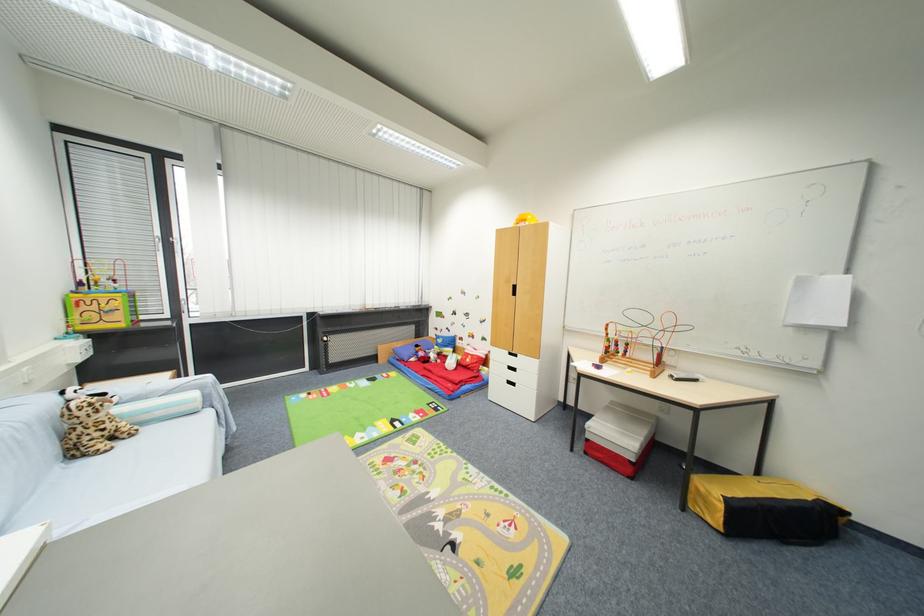
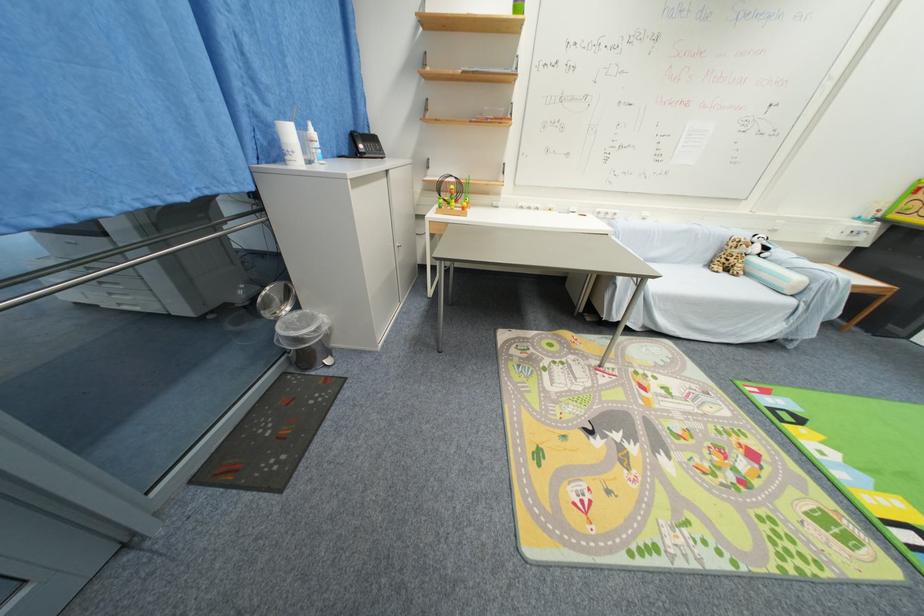
Where in the second image is the point corresponding to pixel 79 456 from the first image?

(714, 265)